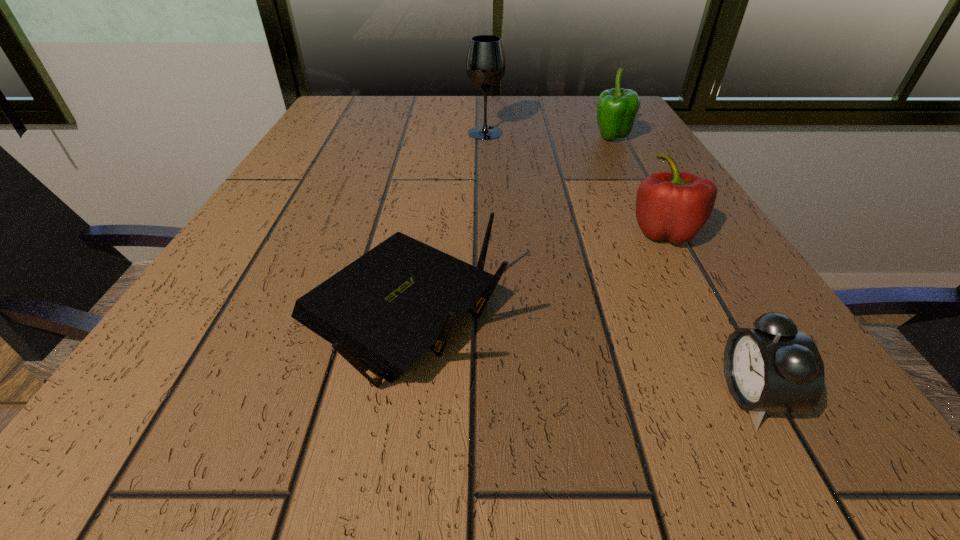
Locate an element on the screen. object that is at the far right corner is located at coordinates (617, 108).

The width and height of the screenshot is (960, 540). Find the location of `object positioned at the near right corner`. object positioned at the near right corner is located at coordinates 774,367.

Where is `free region at the far edge`? Image resolution: width=960 pixels, height=540 pixels. free region at the far edge is located at coordinates (421, 117).

The width and height of the screenshot is (960, 540). In order to click on vacant space at the near edge in this screenshot , I will do `click(323, 424)`.

In the image, there is a desktop. Find the location of `free space at the left edge`. free space at the left edge is located at coordinates (313, 134).

Identify the location of vacant space at the right edge of the desktop. The width and height of the screenshot is (960, 540). (639, 230).

In the image, there is a desktop. Find the location of `vacant space at the far left corner`. vacant space at the far left corner is located at coordinates (372, 126).

Where is `free space at the near left corner`? This screenshot has height=540, width=960. free space at the near left corner is located at coordinates (94, 476).

In the image, there is a desktop. Where is `free space at the far right corner`? This screenshot has width=960, height=540. free space at the far right corner is located at coordinates (568, 98).

Identify the location of vacant region between the wineglass and the second tallest object. (548, 136).